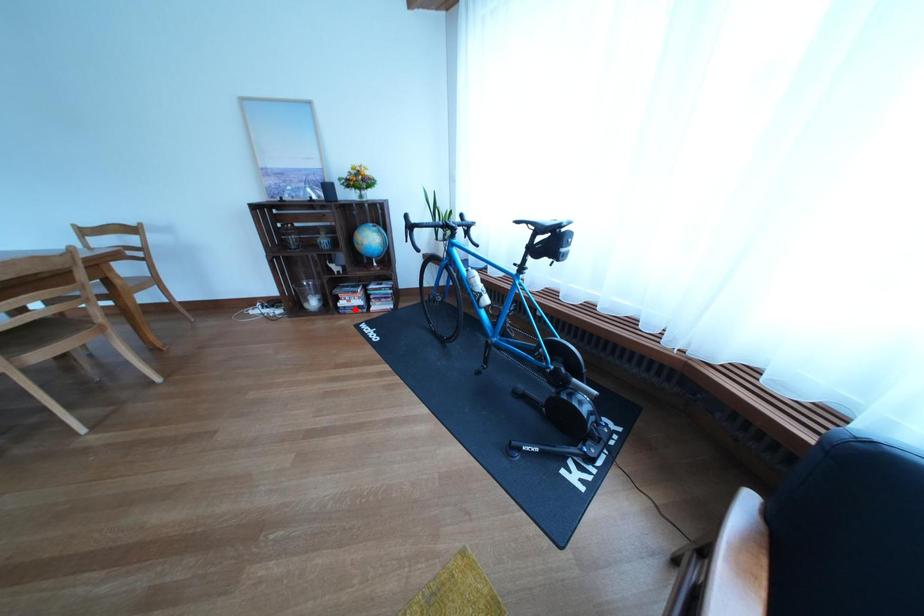
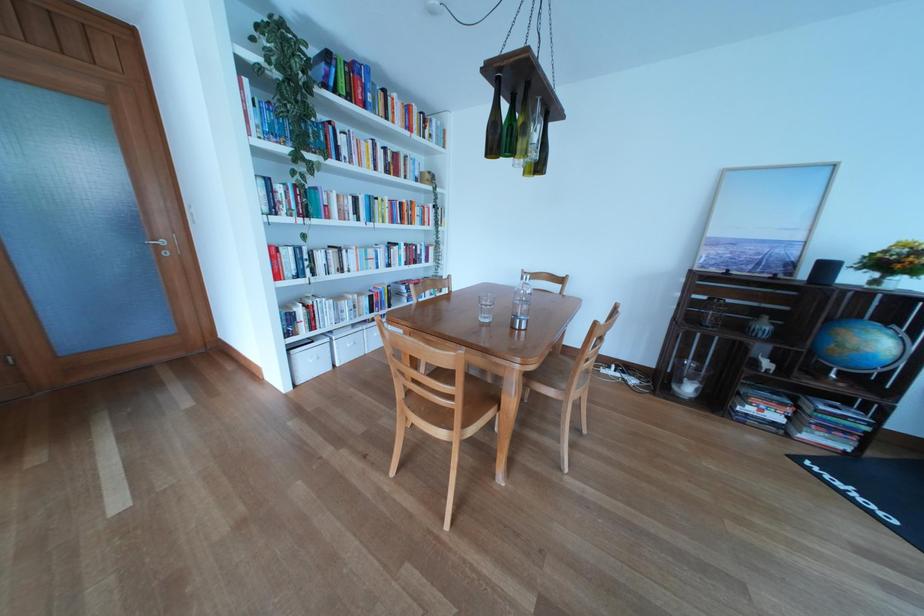
Question: I am providing you with two images of the same scene from different viewpoints. A red point is shown in image1. For the corresponding object point in image2, is it positioned nearer or farther from the camera?

Choices:
 (A) Nearer
 (B) Farther

Answer: (B)